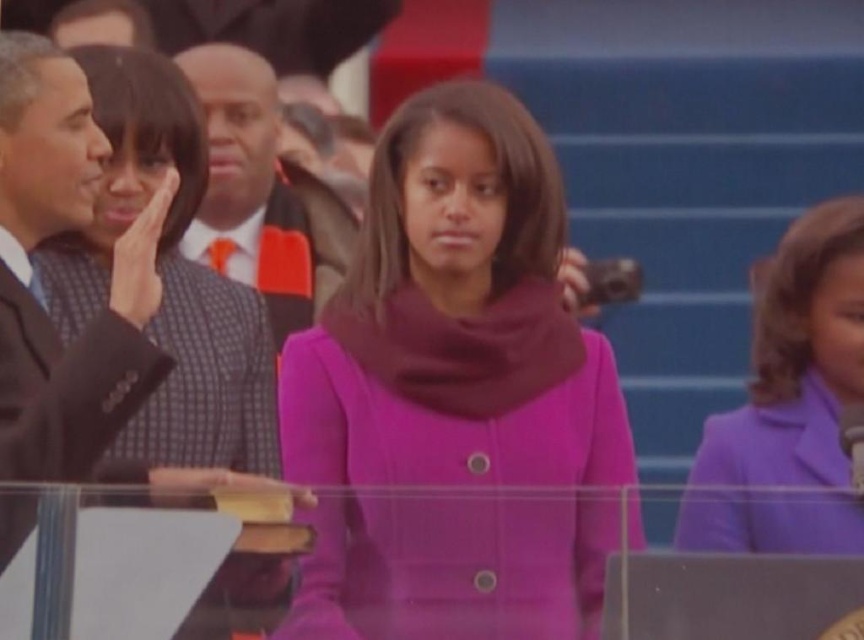
Looking at this image, you are a photographer at the event and need to capture a closeup of the young girl in purple. The matte black suit at left is blocking your direct line of sight. Can you move to the right to get an unobstructed view?

The matte black suit at left is located at point (168,278), so moving to the right might allow you to avoid the obstruction caused by the matte black suit at left and capture the young girl in purple without any blockage.